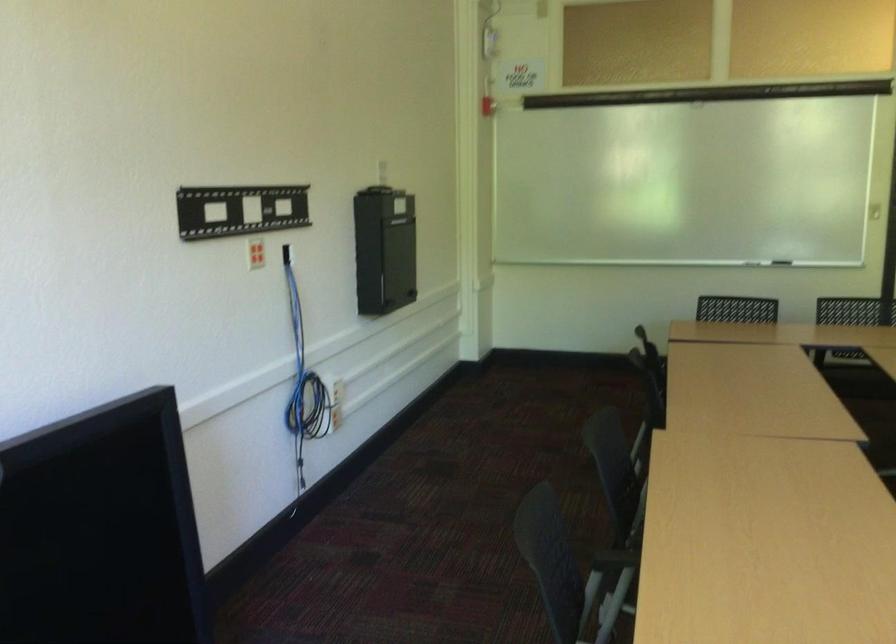
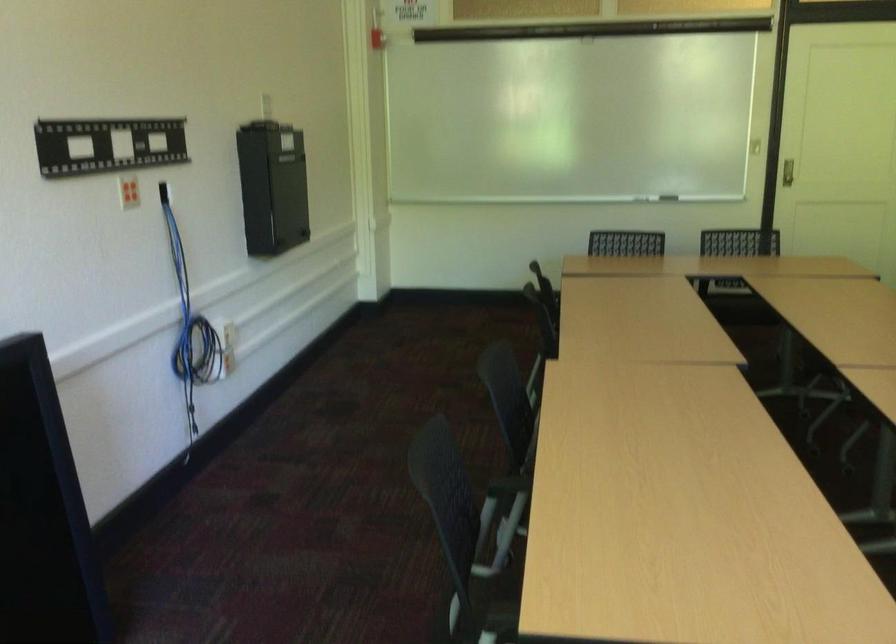
Question: Based on the continuous images, in which direction is the camera rotating? Reply with the corresponding letter.

Choices:
 (A) Left
 (B) Right
 (C) Up
 (D) Down

Answer: (B)